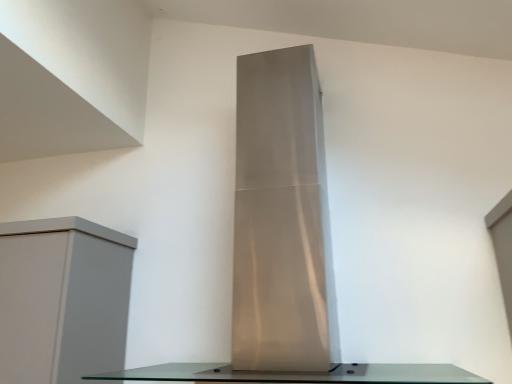
Image resolution: width=512 pixels, height=384 pixels. What do you see at coordinates (63, 299) in the screenshot?
I see `matte gray cabinet at left` at bounding box center [63, 299].

This screenshot has height=384, width=512. Identify the location of matte gray cabinet at left. 63,299.

Image resolution: width=512 pixels, height=384 pixels. I want to click on matte gray cabinet at left, so coord(63,299).